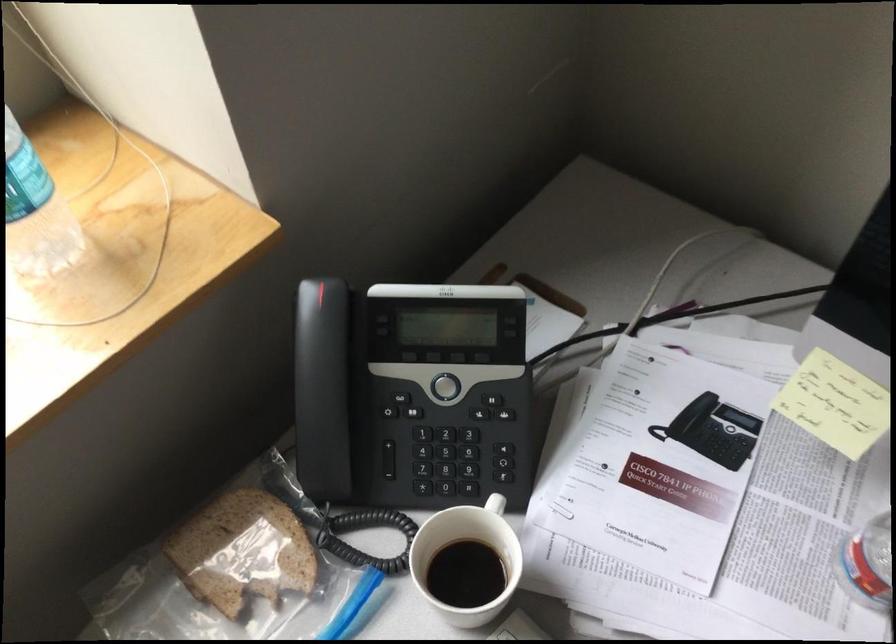
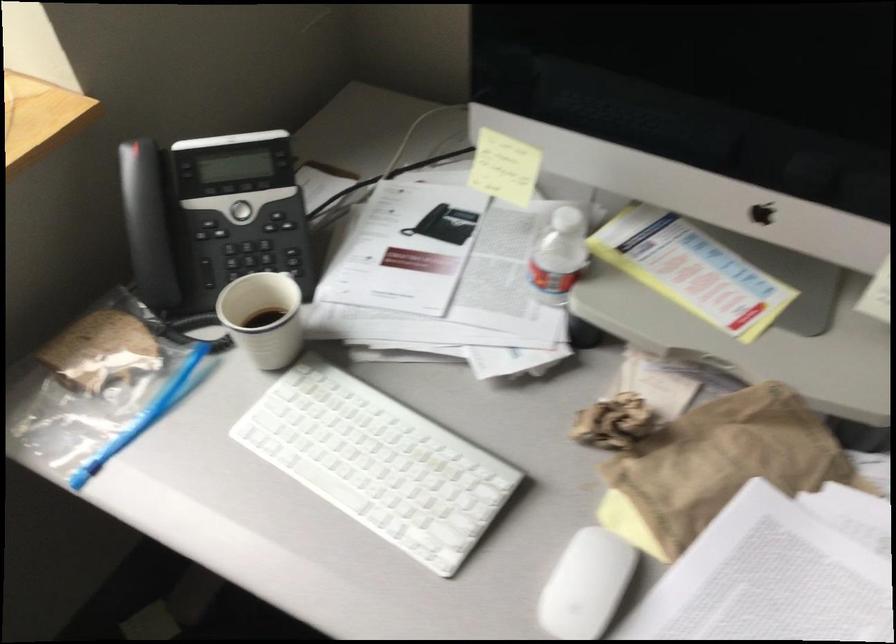
Find the pixel in the second image that matches point 462,440 in the first image.

(259, 250)